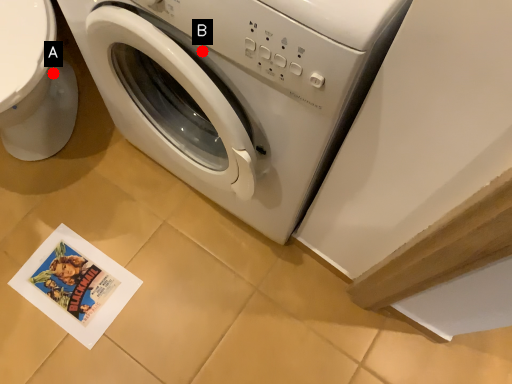
Question: Two points are circled on the image, labeled by A and B beside each circle. Among these points, which one is farthest from the camera?

Choices:
 (A) A is further
 (B) B is further

Answer: (A)